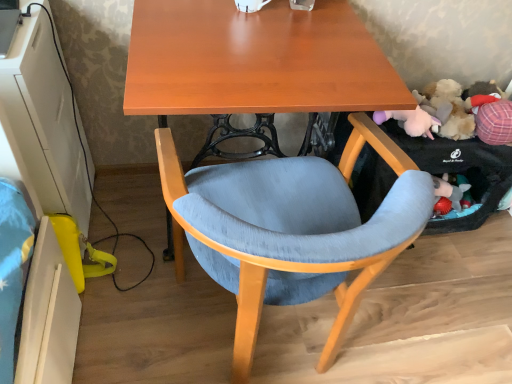
Locate an element on the screen. The width and height of the screenshot is (512, 384). vacant space to the right of white glossy computer desk at lower left is located at coordinates (125, 230).